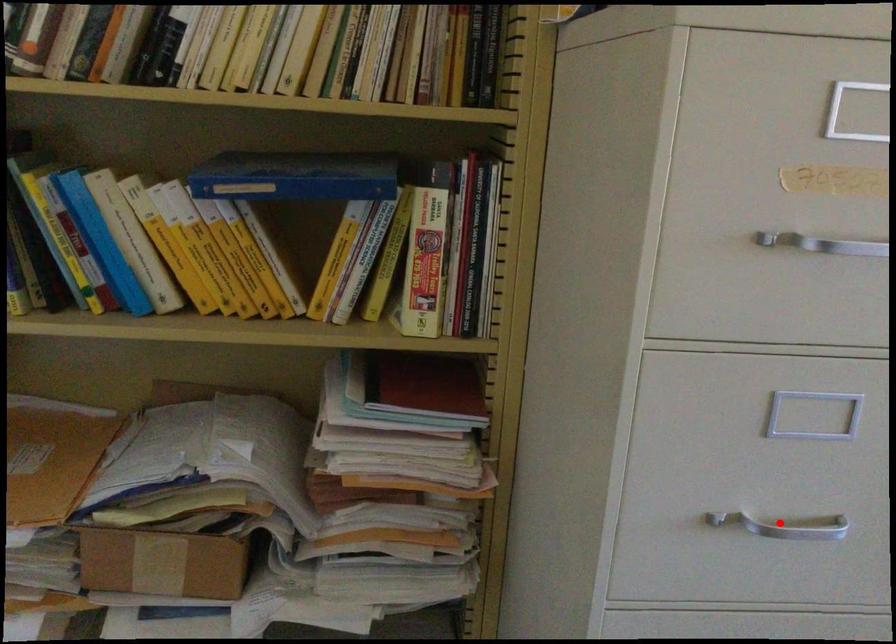
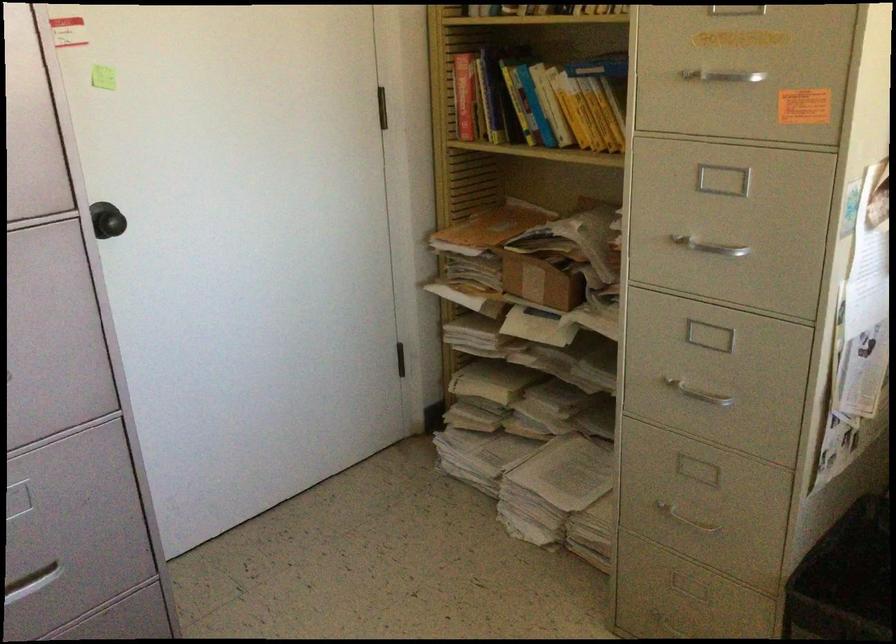
Locate, in the second image, the point that corresponds to the highlighted location in the first image.

(710, 248)